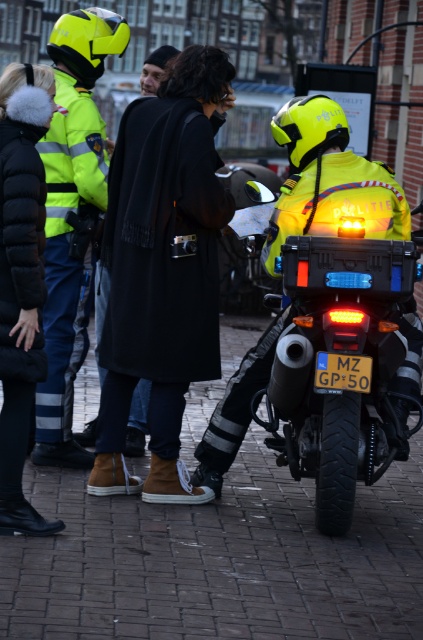
You are a photographer trying to capture a clear shot of both the neon yellow helmet at upper left and the black wool coat at center. Since you want to ensure both are visible in the frame, which object should you focus on first to account for their sizes?

The neon yellow helmet at upper left is larger in size compared to the black wool coat at center, so you should focus on the neon yellow helmet at upper left first to ensure its details are sharp before adjusting for the smaller black wool coat at center.